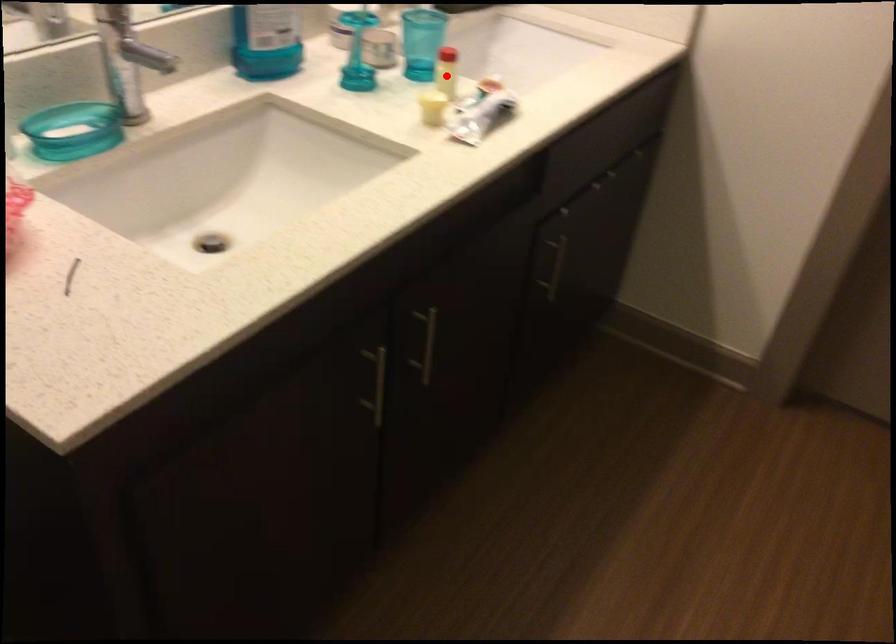
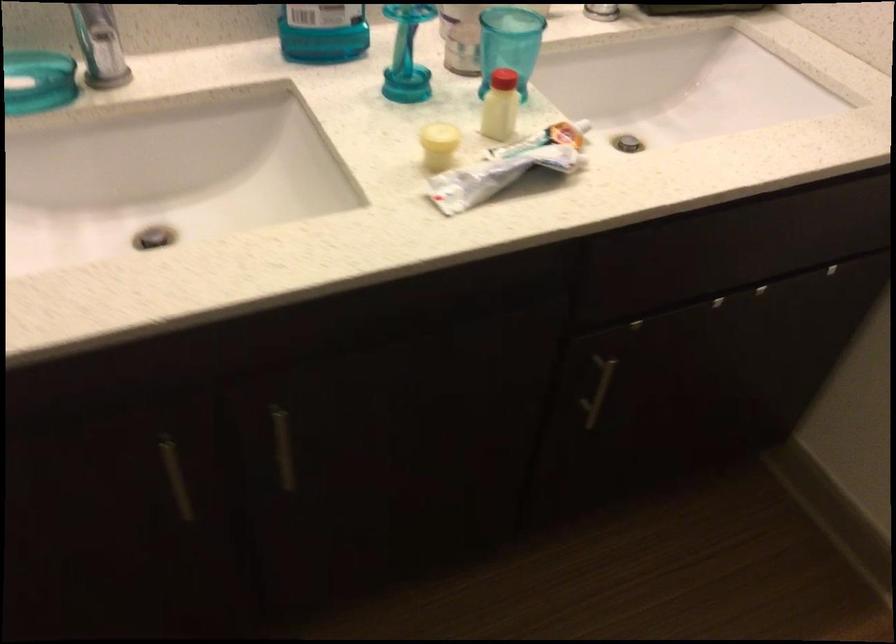
Question: I am providing you with two images of the same scene from different viewpoints. In image1, a red point is highlighted. Considering the same 3D point in image2, which of the following is correct?

Choices:
 (A) It is closer
 (B) It is farther

Answer: (A)